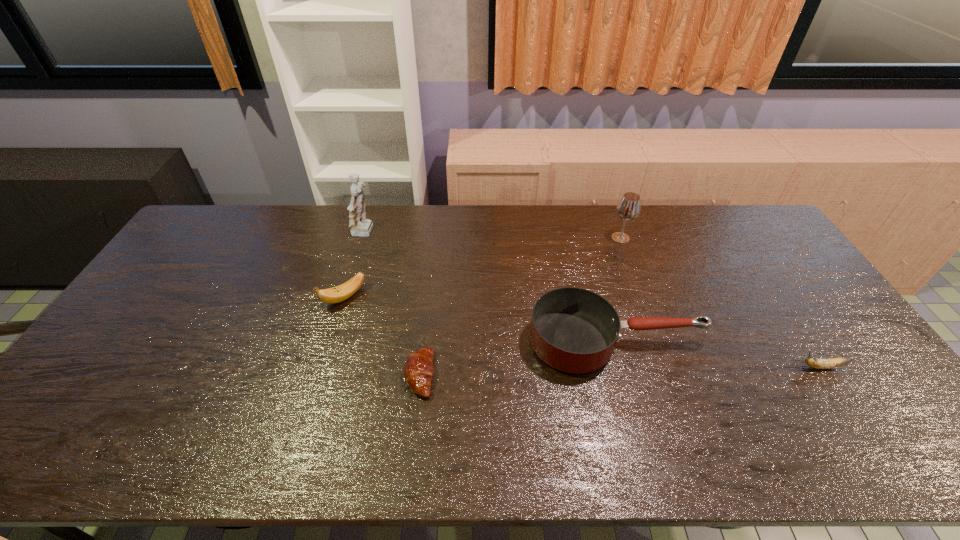
What are the coordinates of `free space in the image that satisfies the following two spatial constraints: 1. on the front-facing side of the tallest object; 2. on the back side of the shortest object` in the screenshot? It's located at (323, 375).

Where is `free space that satisfies the following two spatial constraints: 1. on the front-facing side of the figurine; 2. on the left side of the crescent roll`? The width and height of the screenshot is (960, 540). free space that satisfies the following two spatial constraints: 1. on the front-facing side of the figurine; 2. on the left side of the crescent roll is located at coordinates (323, 375).

Identify the location of vacant space that satisfies the following two spatial constraints: 1. on the front-facing side of the crescent roll; 2. on the left side of the figurine. The height and width of the screenshot is (540, 960). (323, 375).

Find the location of a particular element. Image resolution: width=960 pixels, height=540 pixels. vacant point that satisfies the following two spatial constraints: 1. on the front-facing side of the tallest object; 2. on the back side of the third object from left to right is located at coordinates (323, 375).